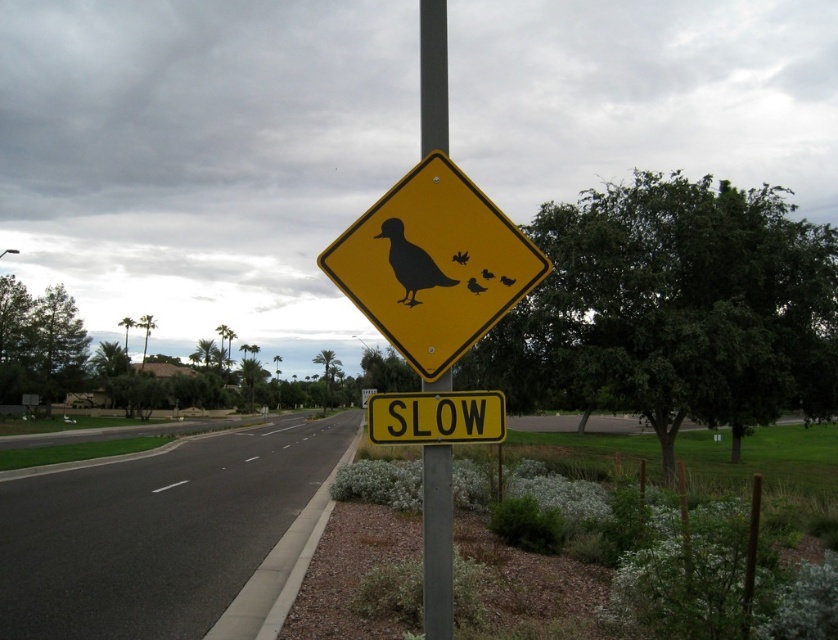
Is matte black duck at center further to camera compared to black matte duck at upper center?

No, matte black duck at center is closer to the viewer.

Is matte black duck at center to the left of black matte duck at upper center from the viewer's perspective?

Indeed, matte black duck at center is positioned on the left side of black matte duck at upper center.

Describe the element at coordinates (474, 285) in the screenshot. Image resolution: width=838 pixels, height=640 pixels. I see `matte black duck at center` at that location.

Locate an element on the screen. This screenshot has height=640, width=838. matte black duck at center is located at coordinates (474, 285).

Can you confirm if yellow diamond-shaped sign with black duck and chicks at center is bigger than black matte duck at center?

Yes, yellow diamond-shaped sign with black duck and chicks at center is bigger than black matte duck at center.

Between yellow diamond-shaped sign with black duck and chicks at center and black matte duck at center, which one has less height?

black matte duck at center is shorter.

Between point (504, 308) and point (391, 228), which one is positioned behind?

The point (391, 228) is more distant.

Find the location of `yellow diamond-shaped sign with black duck and chicks at center`. yellow diamond-shaped sign with black duck and chicks at center is located at coordinates (432, 264).

Is point (534, 275) more distant than point (461, 262)?

That is True.

Based on the photo, does yellow diamond-shaped sign with black duck and chicks at center appear over black matte bird at upper center?

Correct, yellow diamond-shaped sign with black duck and chicks at center is located above black matte bird at upper center.

What do you see at coordinates (432, 264) in the screenshot? I see `yellow diamond-shaped sign with black duck and chicks at center` at bounding box center [432, 264].

At what (x,y) coordinates should I click in order to perform the action: click on yellow diamond-shaped sign with black duck and chicks at center. Please return your answer as a coordinate pair (x, y). Looking at the image, I should click on (432, 264).